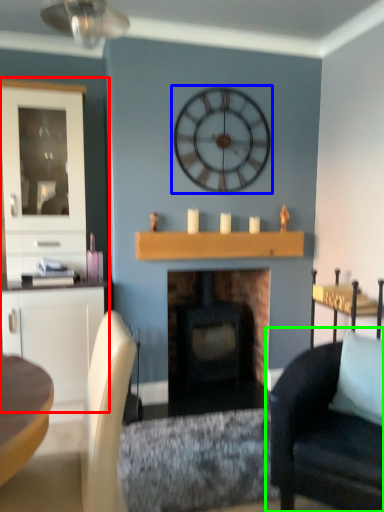
Question: Based on their relative distances, which object is nearer to dresser (highlighted by a red box)? Choose from wall clock (highlighted by a blue box) and chair (highlighted by a green box).

Choices:
 (A) wall clock
 (B) chair

Answer: (A)